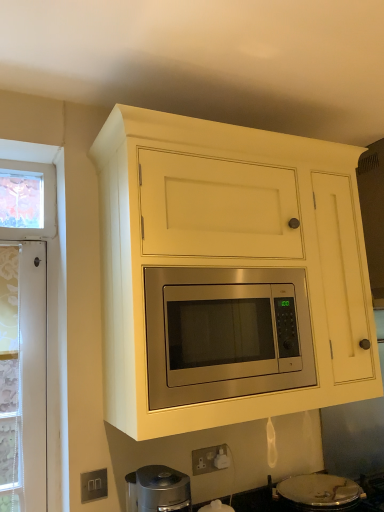
Question: Considering the relative positions of silver metallic gas stove at lower center and stainless steel microwave at center in the image provided, is silver metallic gas stove at lower center to the left of stainless steel microwave at center from the viewer's perspective?

Choices:
 (A) yes
 (B) no

Answer: (B)

Question: Is the depth of silver metallic gas stove at lower center greater than that of stainless steel microwave at center?

Choices:
 (A) yes
 (B) no

Answer: (A)

Question: From a real-world perspective, is silver metallic gas stove at lower center physically below stainless steel microwave at center?

Choices:
 (A) no
 (B) yes

Answer: (B)

Question: Is stainless steel microwave at center a part of silver metallic gas stove at lower center?

Choices:
 (A) yes
 (B) no

Answer: (B)

Question: From the image's perspective, is silver metallic gas stove at lower center below stainless steel microwave at center?

Choices:
 (A) no
 (B) yes

Answer: (B)

Question: Is point (276, 504) positioned closer to the camera than point (253, 346)?

Choices:
 (A) closer
 (B) farther

Answer: (B)

Question: From their relative heights in the image, would you say silver metallic gas stove at lower center is taller or shorter than stainless steel microwave at center?

Choices:
 (A) short
 (B) tall

Answer: (A)

Question: From the image's perspective, is silver metallic gas stove at lower center located above or below stainless steel microwave at center?

Choices:
 (A) above
 (B) below

Answer: (B)

Question: From a real-world perspective, is silver metallic gas stove at lower center positioned above or below stainless steel microwave at center?

Choices:
 (A) above
 (B) below

Answer: (B)

Question: From the image's perspective, relative to matte yellow cabinet at center, is stainless steel microwave at center above or below?

Choices:
 (A) above
 (B) below

Answer: (B)

Question: In the image, is stainless steel microwave at center positioned in front of or behind matte yellow cabinet at center?

Choices:
 (A) behind
 (B) front

Answer: (A)

Question: From a real-world perspective, relative to matte yellow cabinet at center, is stainless steel microwave at center vertically above or below?

Choices:
 (A) above
 (B) below

Answer: (B)

Question: Considering the positions of stainless steel microwave at center and matte yellow cabinet at center in the image, is stainless steel microwave at center taller or shorter than matte yellow cabinet at center?

Choices:
 (A) tall
 (B) short

Answer: (B)

Question: Is matte yellow cabinet at center inside the boundaries of silver metallic gas stove at lower center, or outside?

Choices:
 (A) inside
 (B) outside

Answer: (B)

Question: From their relative heights in the image, would you say matte yellow cabinet at center is taller or shorter than silver metallic gas stove at lower center?

Choices:
 (A) tall
 (B) short

Answer: (A)